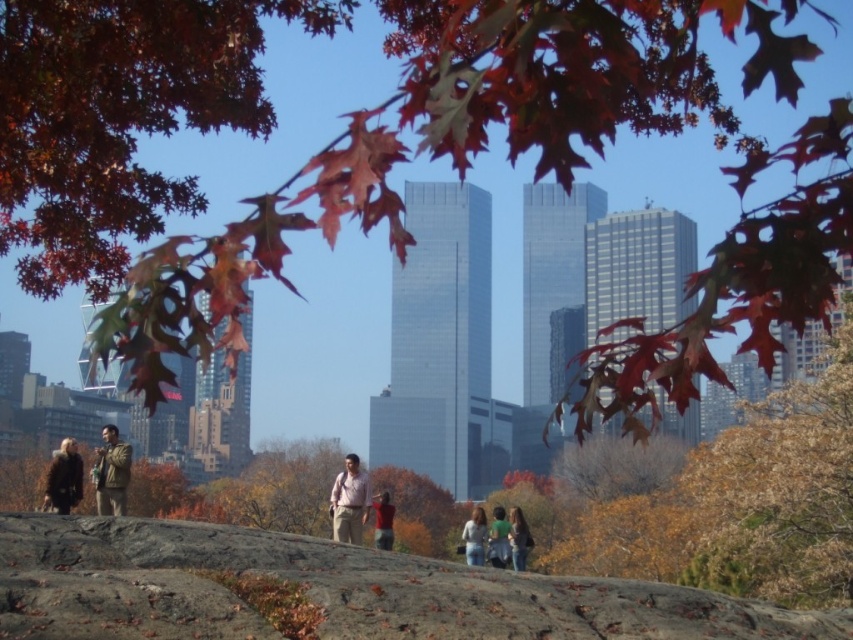
You are a photographer standing at the edge of the park, looking at the light brown hair at center and the camera. Which object is closer to you?

The light brown hair at center is closer to you than the camera because they are 245.58 meters apart.

You are a photographer trying to capture a shot of the two points in the image. Which point, point (x=474, y=538) or point (x=500, y=509), is positioned closer to the camera?

Point (x=474, y=538) is closer to the camera than point (x=500, y=509).

Based on the photo, you are a photographer trying to capture a shot of the shiny red maple leaf at upper center and the light brown hair at center. Which object is positioned higher in the frame?

The shiny red maple leaf at upper center has a greater height compared to the light brown hair at center, so it is positioned higher in the frame.